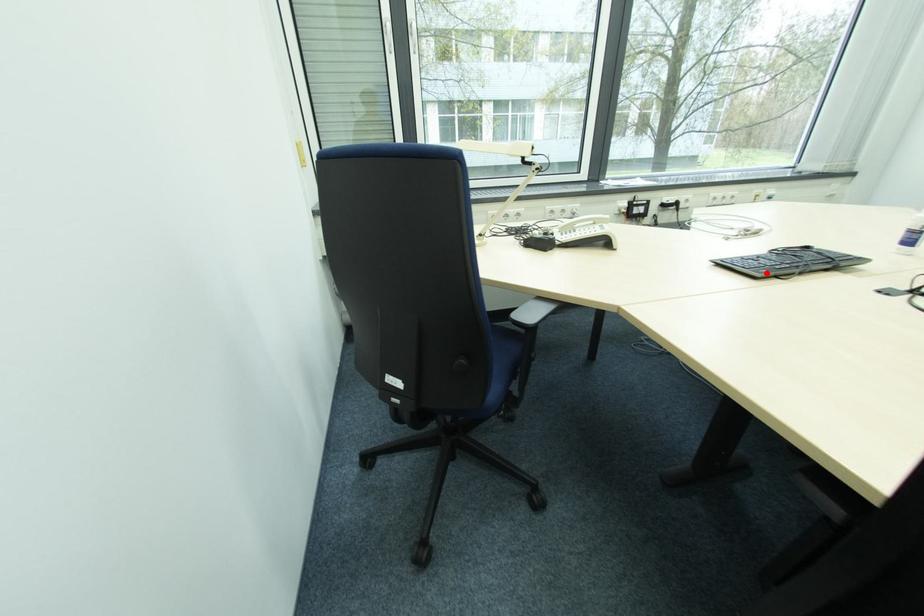
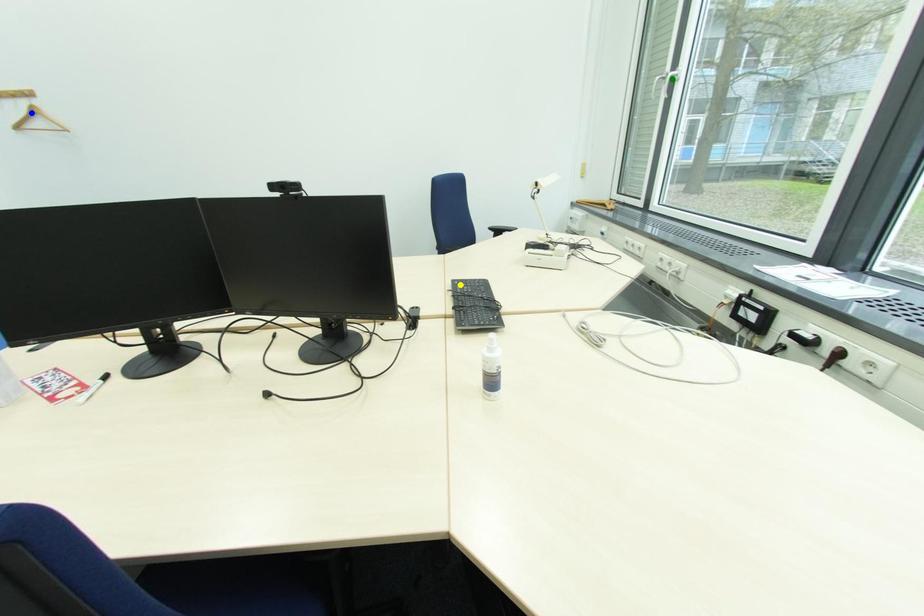
Question: I am providing you with two images of the same scene from different viewpoints. A red point is marked on the first image. You are given multiple points on the second image. Which point in image 2 is actually the same real-world point as the red point in image 1?

Choices:
 (A) yellow point
 (B) blue point
 (C) green point

Answer: (A)